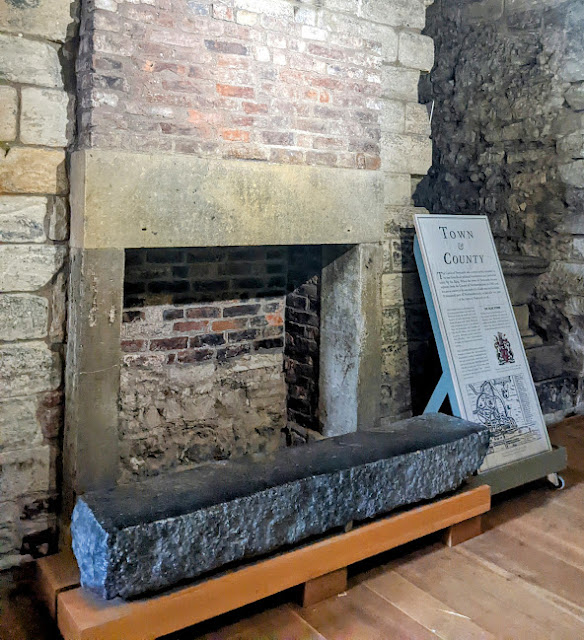
The height and width of the screenshot is (640, 584). What are the coordinates of `fireplace brick walls` in the screenshot? It's located at (206, 312), (305, 319), (232, 65).